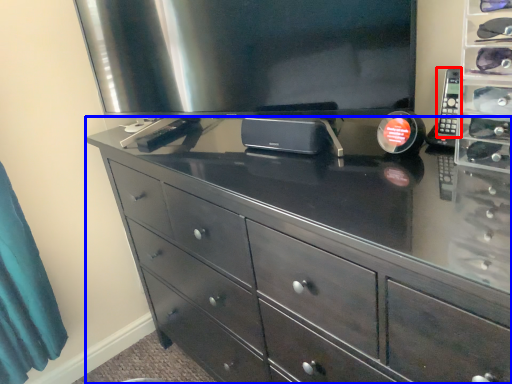
Question: Among these objects, which one is farthest to the camera, control (highlighted by a red box) or chest of drawers (highlighted by a blue box)?

Choices:
 (A) control
 (B) chest of drawers

Answer: (A)